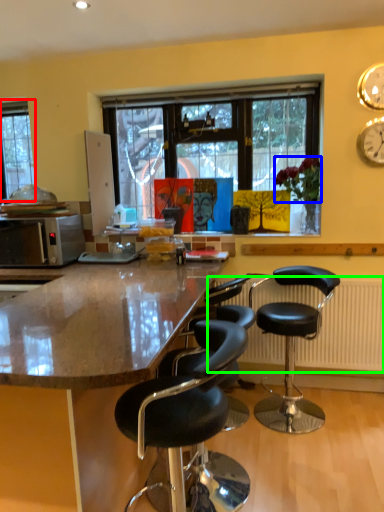
Question: Estimate the real-world distances between objects in this image. Which object is farther from window (highlighted by a red box), flower (highlighted by a blue box) or radiator (highlighted by a green box)?

Choices:
 (A) flower
 (B) radiator

Answer: (B)